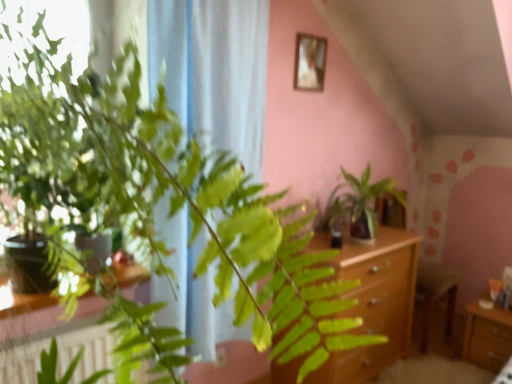
Question: Considering the relative positions of wooden frame at upper center and wooden drawer at lower right in the image provided, is wooden frame at upper center to the right of wooden drawer at lower right from the viewer's perspective?

Choices:
 (A) no
 (B) yes

Answer: (A)

Question: Is wooden frame at upper center smaller than wooden drawer at lower right?

Choices:
 (A) yes
 (B) no

Answer: (A)

Question: Considering the relative sizes of wooden frame at upper center and wooden drawer at lower right in the image provided, is wooden frame at upper center bigger than wooden drawer at lower right?

Choices:
 (A) no
 (B) yes

Answer: (A)

Question: Is wooden frame at upper center at the left side of wooden drawer at lower right?

Choices:
 (A) no
 (B) yes

Answer: (B)

Question: Considering the relative positions of wooden frame at upper center and wooden drawer at lower right in the image provided, is wooden frame at upper center in front of wooden drawer at lower right?

Choices:
 (A) no
 (B) yes

Answer: (B)

Question: From a real-world perspective, is wooden frame at upper center beneath wooden drawer at lower right?

Choices:
 (A) no
 (B) yes

Answer: (A)

Question: Is wooden drawer at lower right outside green glossy plant at center?

Choices:
 (A) no
 (B) yes

Answer: (B)

Question: Is wooden drawer at lower right closer to camera compared to green glossy plant at center?

Choices:
 (A) yes
 (B) no

Answer: (B)

Question: Can you confirm if wooden drawer at lower right is wider than green glossy plant at center?

Choices:
 (A) no
 (B) yes

Answer: (A)

Question: Considering the relative sizes of wooden drawer at lower right and green glossy plant at center in the image provided, is wooden drawer at lower right thinner than green glossy plant at center?

Choices:
 (A) yes
 (B) no

Answer: (A)

Question: Does wooden drawer at lower right have a greater height compared to green glossy plant at center?

Choices:
 (A) yes
 (B) no

Answer: (B)

Question: Is wooden drawer at lower right looking in the opposite direction of green glossy plant at center?

Choices:
 (A) no
 (B) yes

Answer: (A)

Question: From a real-world perspective, is white sheer curtain at left on light brown wooden dresser at center?

Choices:
 (A) yes
 (B) no

Answer: (A)